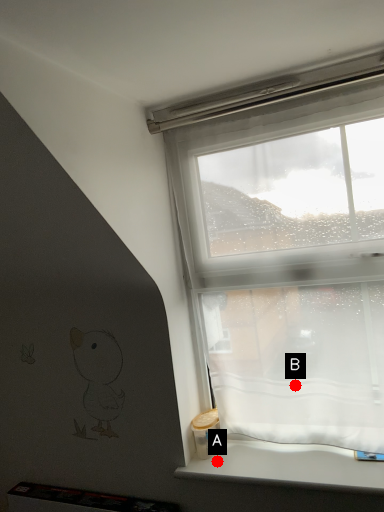
Question: Two points are circled on the image, labeled by A and B beside each circle. Which point is closer to the camera?

Choices:
 (A) A is closer
 (B) B is closer

Answer: (A)